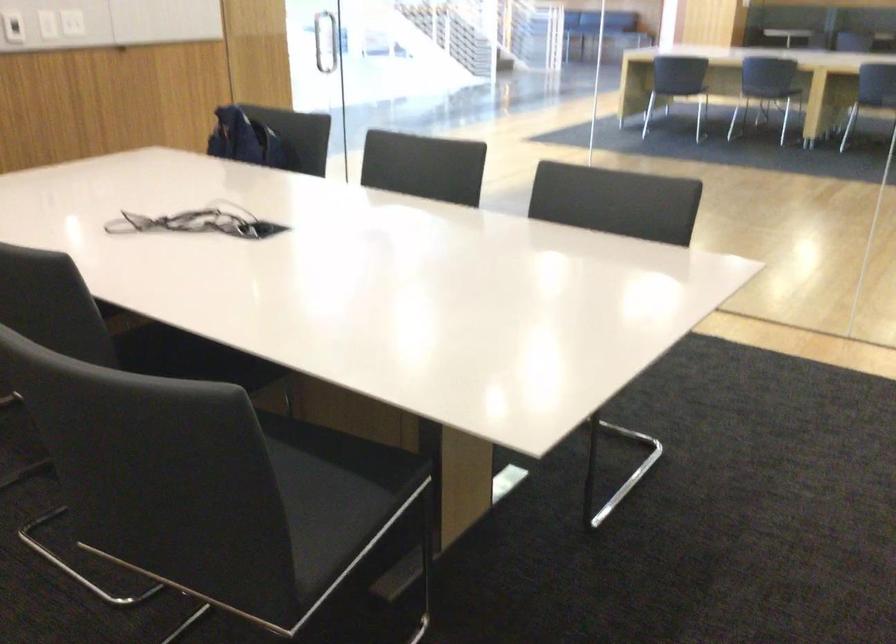
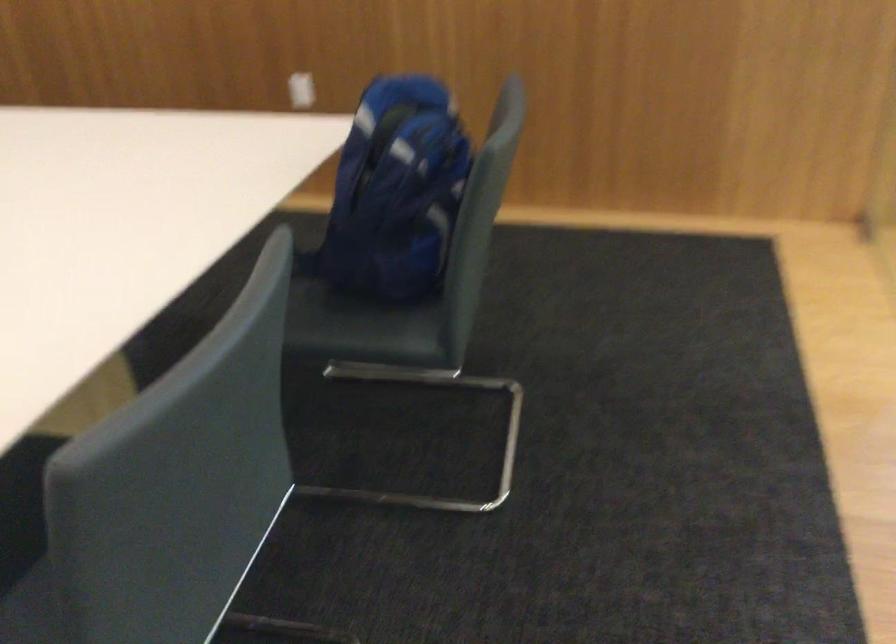
Find the pixel in the second image that matches pixel 271 152 in the first image.

(395, 192)